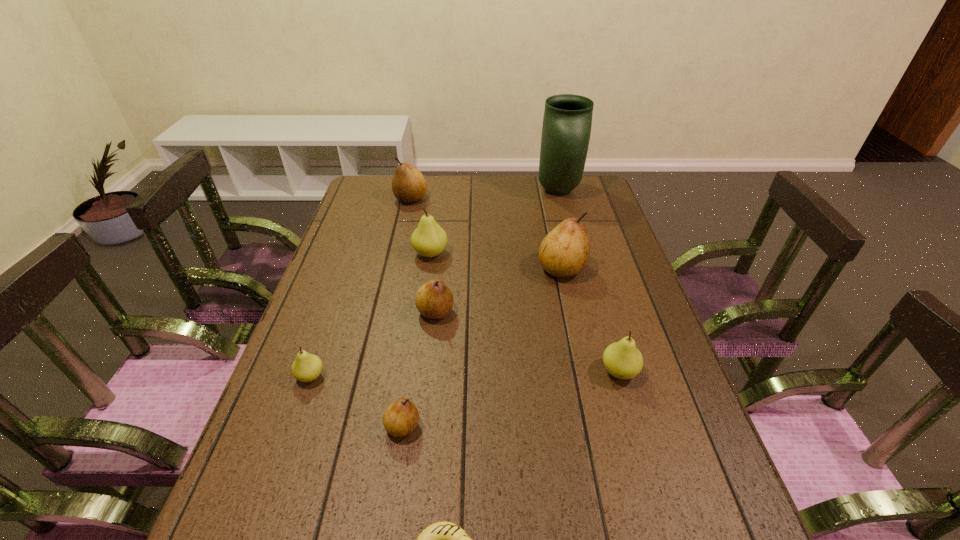
Identify the location of free space that satisfies the following two spatial constraints: 1. on the back side of the farthest green pear; 2. on the right side of the vase. (439, 191).